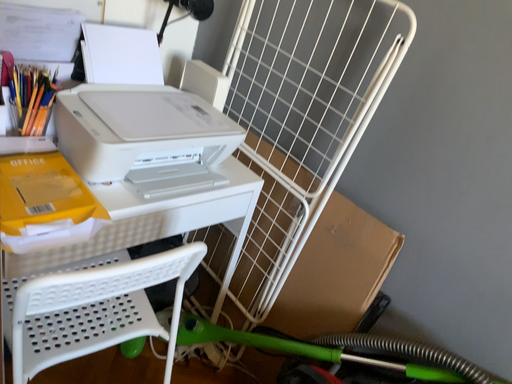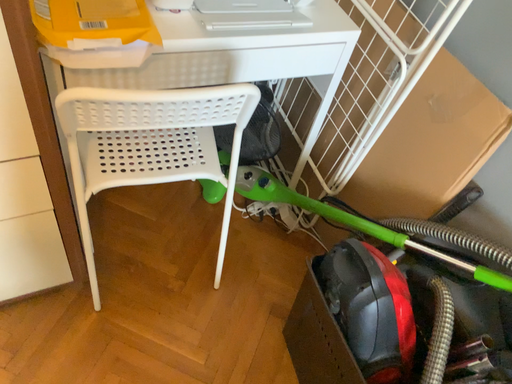
Question: Which way did the camera rotate in the video?

Choices:
 (A) rotated downward
 (B) rotated upward

Answer: (A)